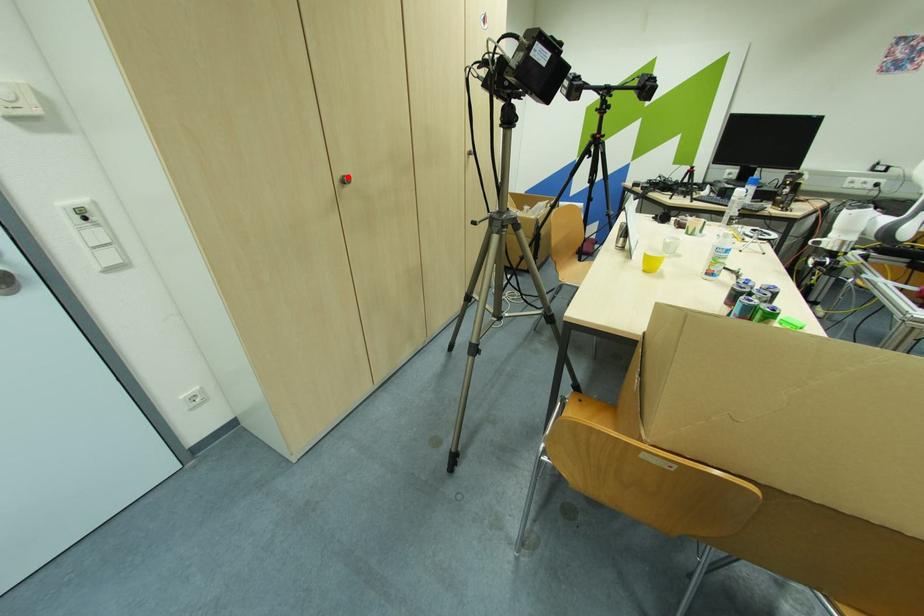
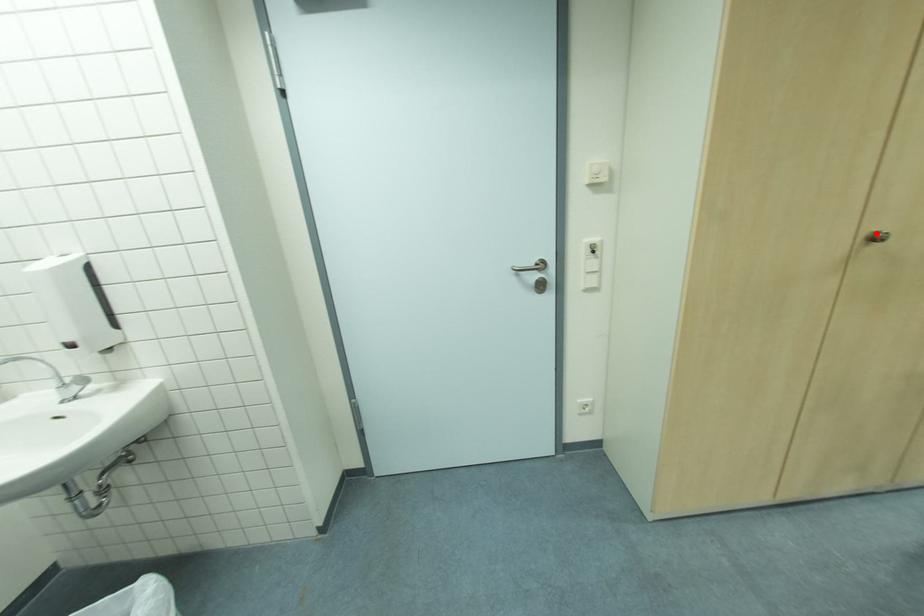
I am providing you with two images of the same scene from different viewpoints. A red point is marked on the first image and another point is marked on the second image. Do the highlighted points in image1 and image2 indicate the same real-world spot?

Yes